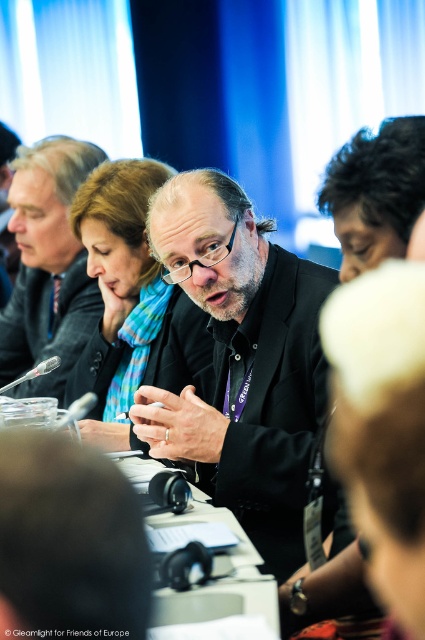
You are an attendee at this conference and want to take a photo of the matte black jacket at center. The camera you are using has a focal length of 50mm and a sensor size of 24mm x 36mm. If you are standing 2 meters away from the jacket, what is the approximate width of the jacket in millimeters in your photo?

The width of the jacket in the photo can be calculated using the formula width_in_photo mm 50mm focal length x 2000mm distance 24mm sensor width. Plugging in the values, width_in_photo 50 x 2000 24 4166.67 mm. However, this calculation assumes the sensor width corresponds to the horizontal dimension, so the jacket width would be approximately 4167 mm in the photo.

You are sitting at the conference table and want to pass a document to the person at point [163,609]. Is the person at point [87,161] behind or in front of them?

The person at point [87,161] is behind the person at point [163,609].